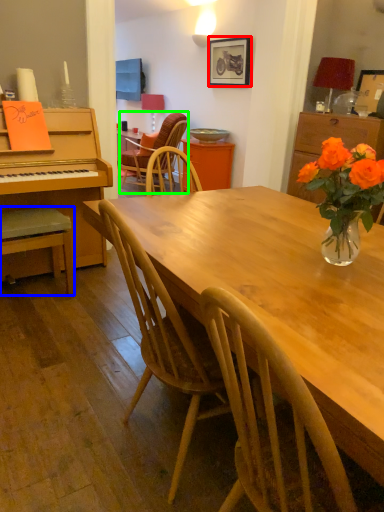
Question: Considering the real-world distances, which object is closest to picture frame (highlighted by a red box)? chair (highlighted by a blue box) or chair (highlighted by a green box).

Choices:
 (A) chair
 (B) chair

Answer: (B)